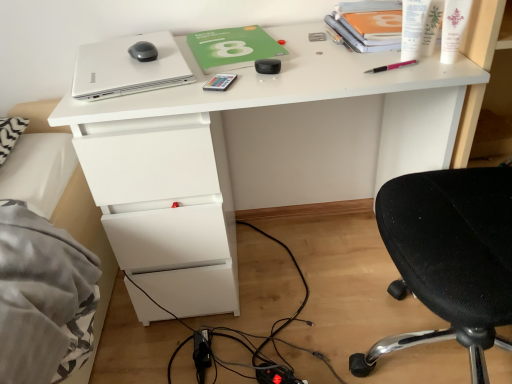
Where is `free space to the right of pink plastic pen at upper right, the second stationery in the left-to-right sequence`? free space to the right of pink plastic pen at upper right, the second stationery in the left-to-right sequence is located at coordinates (437, 64).